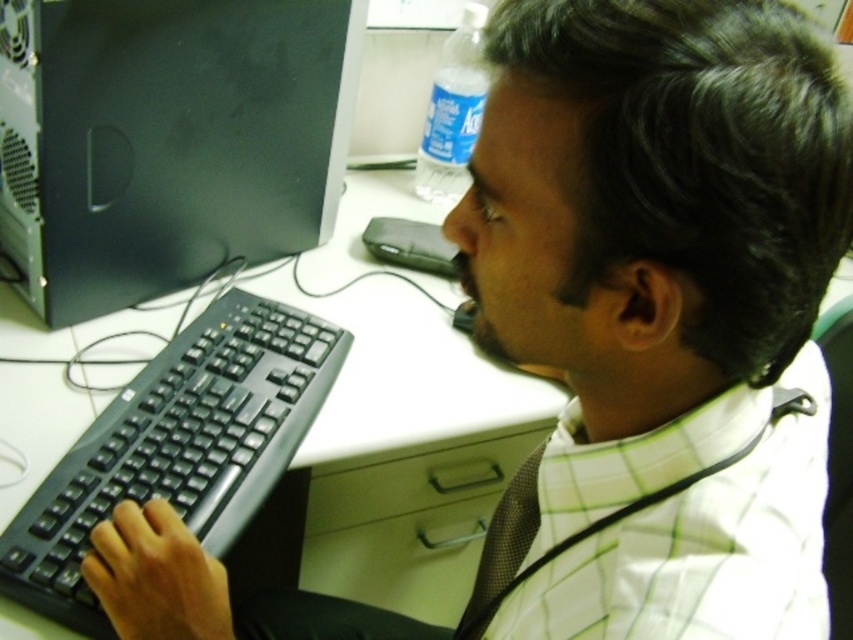
You are standing in front of the desk and want to place a new item at the exact coordinates of point (166,140). What object is currently located there?

The black plastic desktop computer at left is located at point (166,140).

Looking at this image, you are trying to figure out if you can place a new mouse on the desk between the black plastic desktop computer at left and the black plastic keyboard at left. Since the mouse requires 10 cm of space, can you determine if there is enough space between them?

The black plastic desktop computer at left is much taller than the black plastic keyboard at left, but their horizontal spacing isn not mentioned. Without knowing the distance between them, it is impossible to determine if there is enough space for the mouse.